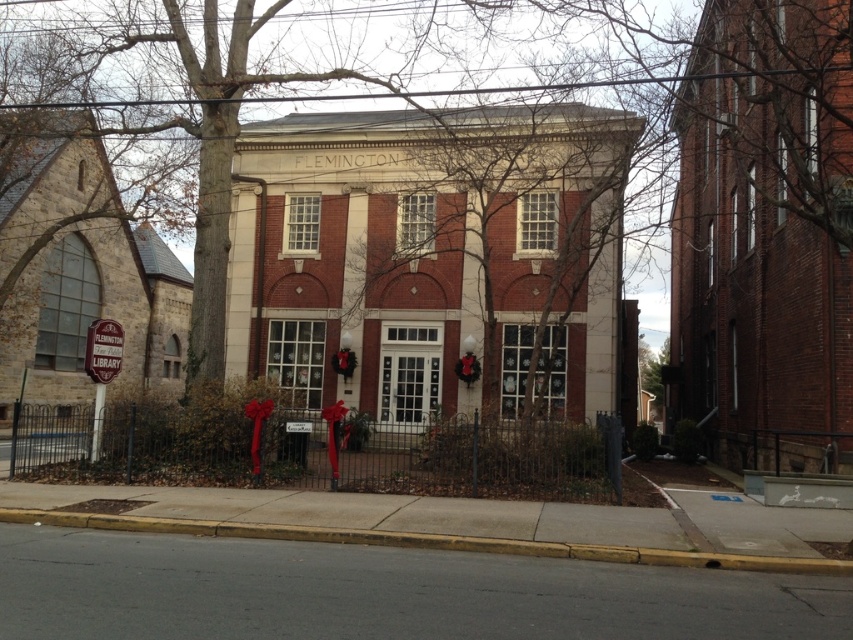
Question: Is the position of brick building at center less distant than that of stone church at left?

Choices:
 (A) no
 (B) yes

Answer: (A)

Question: Does brick building at center come behind brick church at right?

Choices:
 (A) yes
 (B) no

Answer: (A)

Question: Which of the following is the closest to the observer?

Choices:
 (A) brick building at center
 (B) metallic wire fence at center
 (C) stone church at left

Answer: (B)

Question: Among these objects, which one is farthest from the camera?

Choices:
 (A) brick building at center
 (B) brick church at right

Answer: (A)

Question: Considering the real-world distances, which object is closest to the stone church at left?

Choices:
 (A) brick building at center
 (B) metallic wire fence at center
 (C) brick church at right

Answer: (B)

Question: Does brick building at center come in front of stone church at left?

Choices:
 (A) no
 (B) yes

Answer: (A)